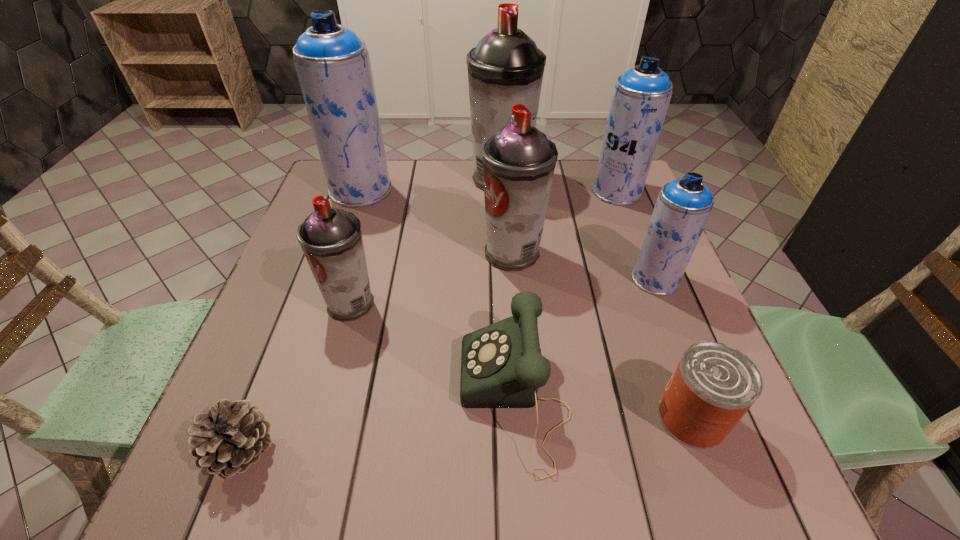
Identify the location of vacant region located 0.130m on the left of the farthest gray aerosol can. The image size is (960, 540). (424, 179).

Identify the location of free point located on the front of the biggest blue aerosol can. (317, 320).

Image resolution: width=960 pixels, height=540 pixels. Identify the location of vacant space located on the front of the second biggest blue aerosol can. (659, 299).

Find the location of a particular element. The height and width of the screenshot is (540, 960). free space located 0.110m on the back of the second nearest gray aerosol can is located at coordinates (509, 207).

Identify the location of vacant region located on the right of the leftmost gray aerosol can. The height and width of the screenshot is (540, 960). (513, 303).

Where is `blank space located on the front of the smallest blue aerosol can`? The width and height of the screenshot is (960, 540). blank space located on the front of the smallest blue aerosol can is located at coordinates [691, 370].

Identify the location of free space located on the left of the can. The height and width of the screenshot is (540, 960). (462, 417).

Locate an element on the screen. The image size is (960, 540). free location located on the dial of the telephone is located at coordinates (243, 399).

Where is `free region located on the dial of the telephone`? free region located on the dial of the telephone is located at coordinates [243, 399].

This screenshot has height=540, width=960. Identify the location of free location located on the dial of the telephone. 253,399.